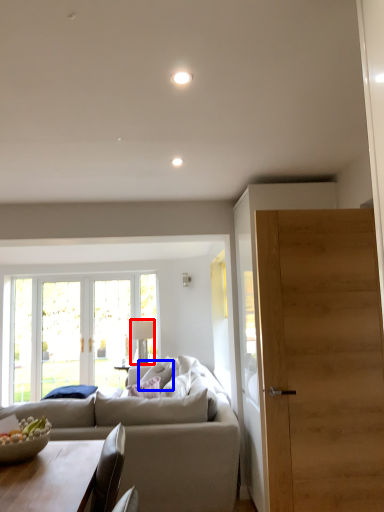
Question: Which object is closer to the camera taking this photo, lamp (highlighted by a red box) or pillow (highlighted by a blue box)?

Choices:
 (A) lamp
 (B) pillow

Answer: (B)